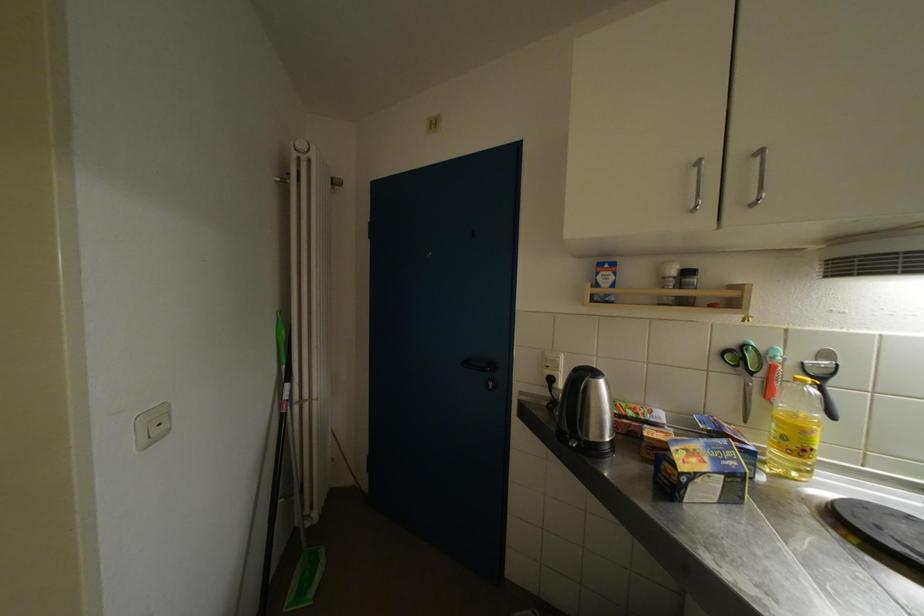
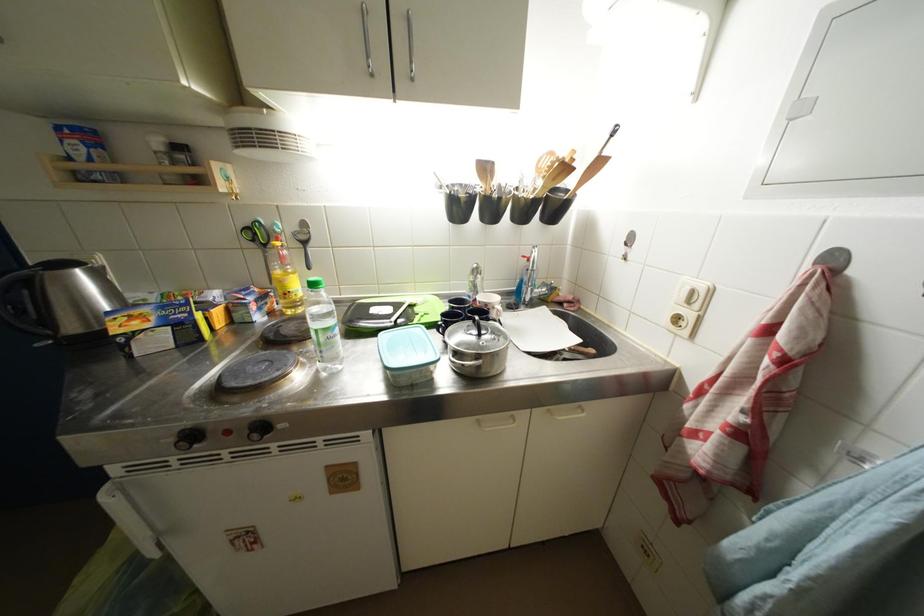
The point at (736,347) is marked in the first image. Where is the corresponding point in the second image?

(253, 227)